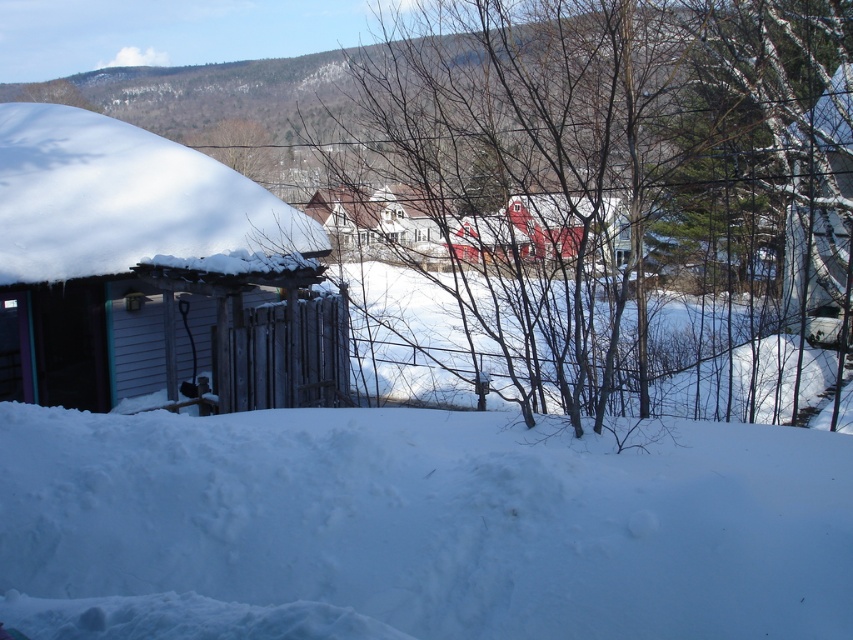
You are standing at the fence in the winter scene and want to walk to the white wooden house at center. Which direction should you head towards from the wooden shed at left?

You should head to the right from the wooden shed at left to reach the white wooden house at center since the wooden shed at left is to the left of white wooden house at center.

You are standing in the winter scene and want to place a small snowman exactly where the white fluffy snow at lower center and the bare branches at center are. Which object should you use as the base for the snowman?

The white fluffy snow at lower center is below the bare branches at center, so you should use the white fluffy snow at lower center as the base for the snowman since it is located lower and provides a stable foundation.

You are standing in the winter scene and want to place a small decoration. You have two points marked in the image, point [782,486] and point [358,125]. Which point is closer to you?

Point [782,486] is closer to the camera than point [358,125], so it is the closer point.